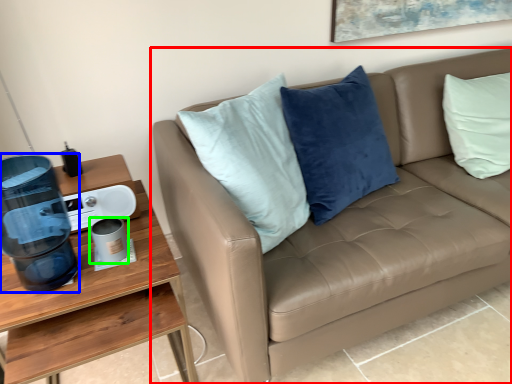
Question: Based on their relative distances, which object is farther from studio couch (highlighted by a red box)? Choose from water cooler (highlighted by a blue box) and coffee cup (highlighted by a green box).

Choices:
 (A) water cooler
 (B) coffee cup

Answer: (B)